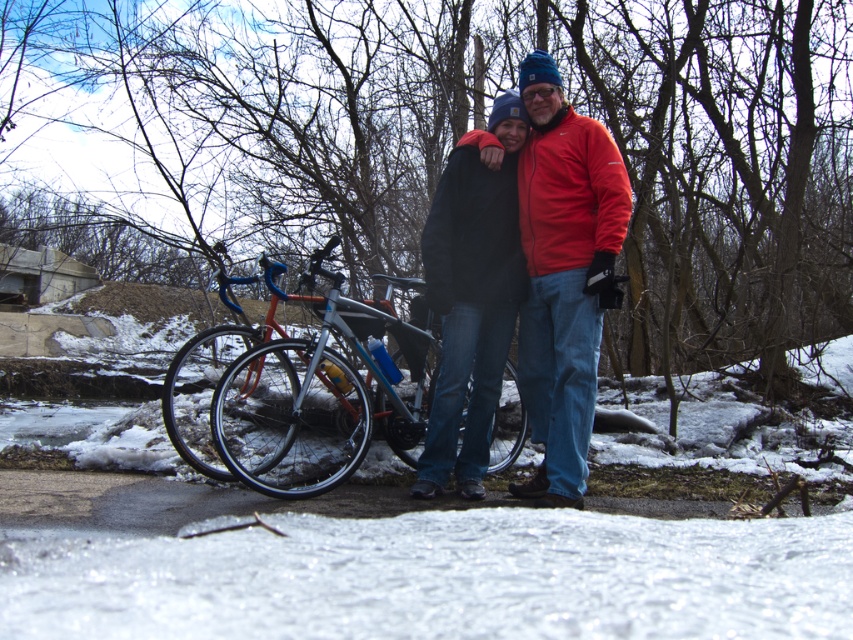
You are a photographer trying to capture a photo of the matte black jacket at center and the shiny metallic bicycle at center. Based on their positions, which object is closer to the left side of the image?

The shiny metallic bicycle at center is closer to the left side of the image because the matte black jacket at center is to the right of it.

You are a photographer trying to capture a photo of the shiny metallic bicycle at center and the black matte jacket at center. Since you want to ensure both are clearly visible, which object should you focus on first considering their sizes?

The shiny metallic bicycle at center is larger than the black matte jacket at center, so you should focus on the shiny metallic bicycle at center first to ensure it is in clear focus before adjusting for the smaller object.

You are a photographer trying to capture both the matte black jacket at center and the black matte jacket at center in the same frame. Which jacket should you focus on first if you want to ensure both are in focus?

The matte black jacket at center is bigger than the black matte jacket at center, so focusing on the larger one first will help ensure both are in focus.